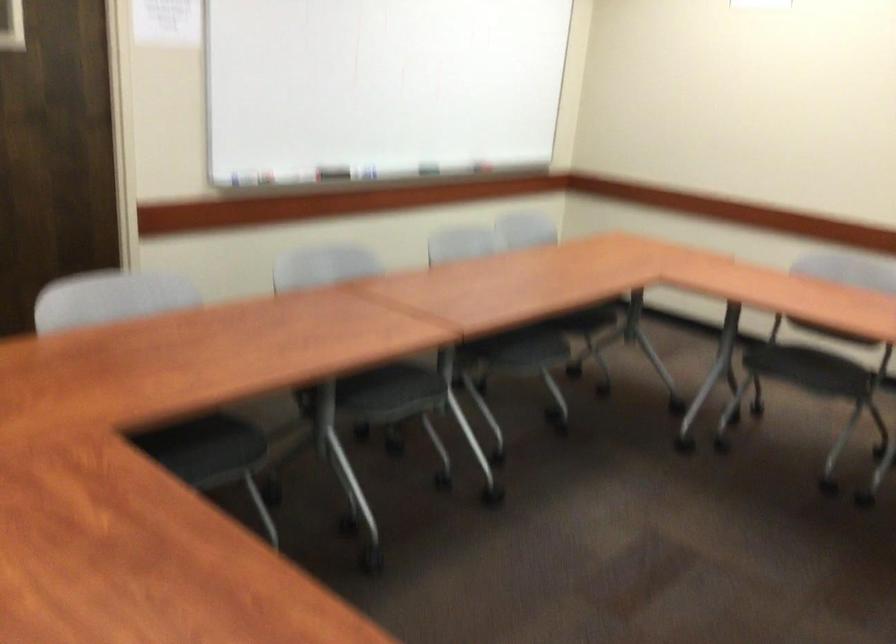
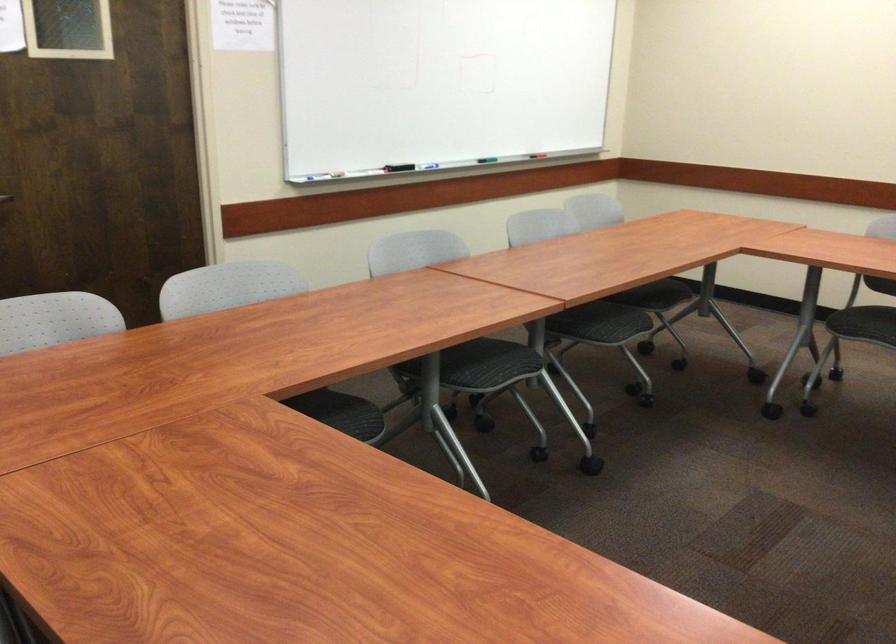
Locate, in the second image, the point that corresponds to point 770,366 in the first image.

(857, 319)